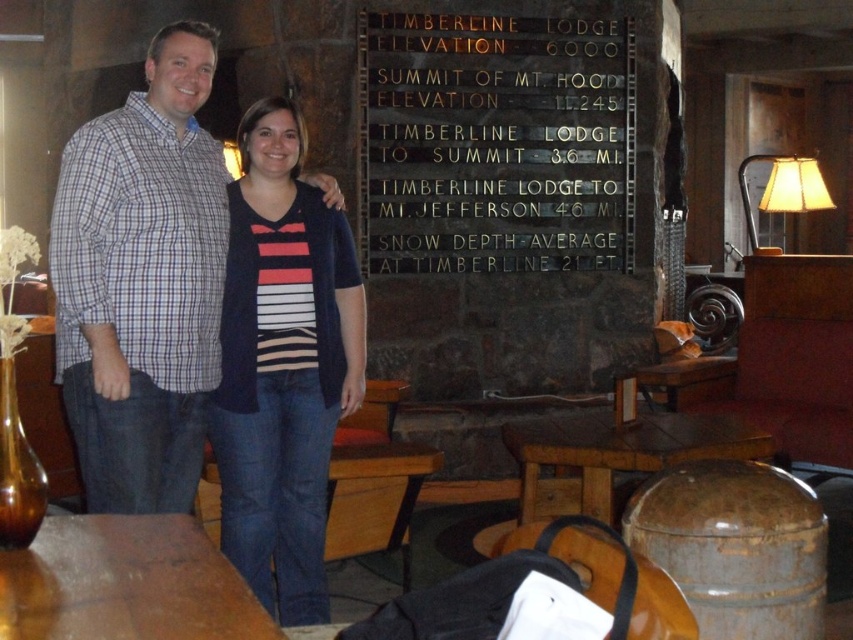
You are a fashion designer observing two people in the lobby of Timberline Lodge. You notice the plaid cotton shirt at center and the striped knit sweater at center. Which clothing item is positioned higher on the person wearing them?

The plaid cotton shirt at center is located above the striped knit sweater at center, so the plaid cotton shirt at center is positioned higher on the person wearing them.

You are a fashion designer observing two people at Timberline Lodge. You notice the plaid cotton shirt at center and the striped knit sweater at center. Which clothing item has a smaller width?

The plaid cotton shirt at center is thinner than the striped knit sweater at center, so the plaid cotton shirt at center has a smaller width.